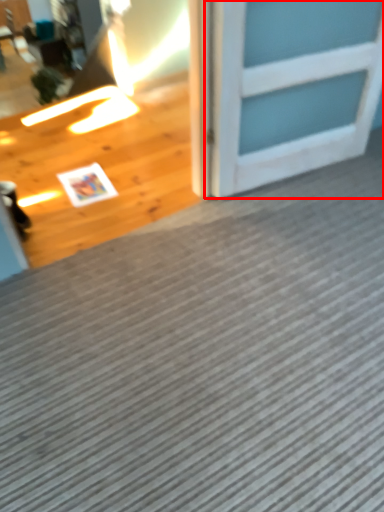
Question: From the image, what is the correct spatial relationship of door (annotated by the red box) in relation to doormat?

Choices:
 (A) right
 (B) left

Answer: (A)